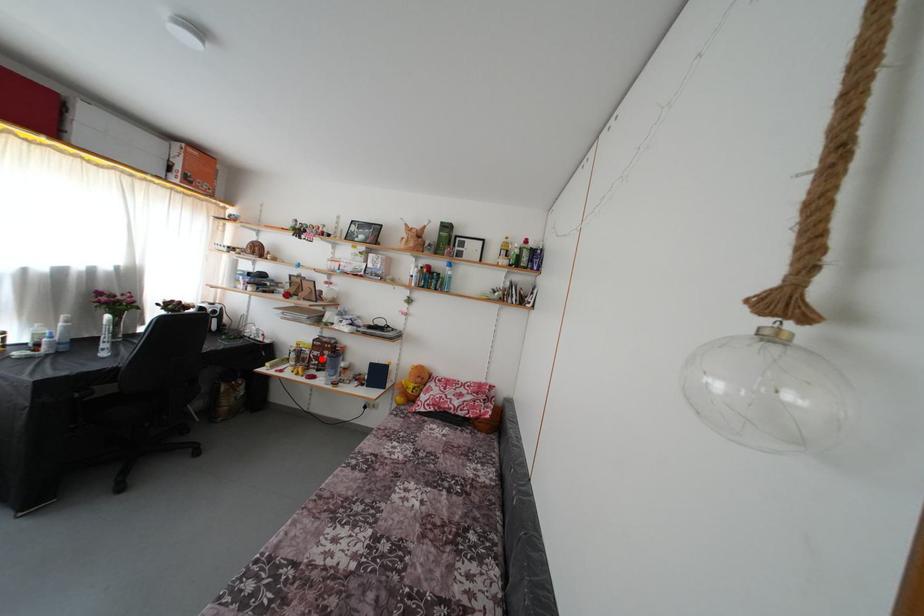
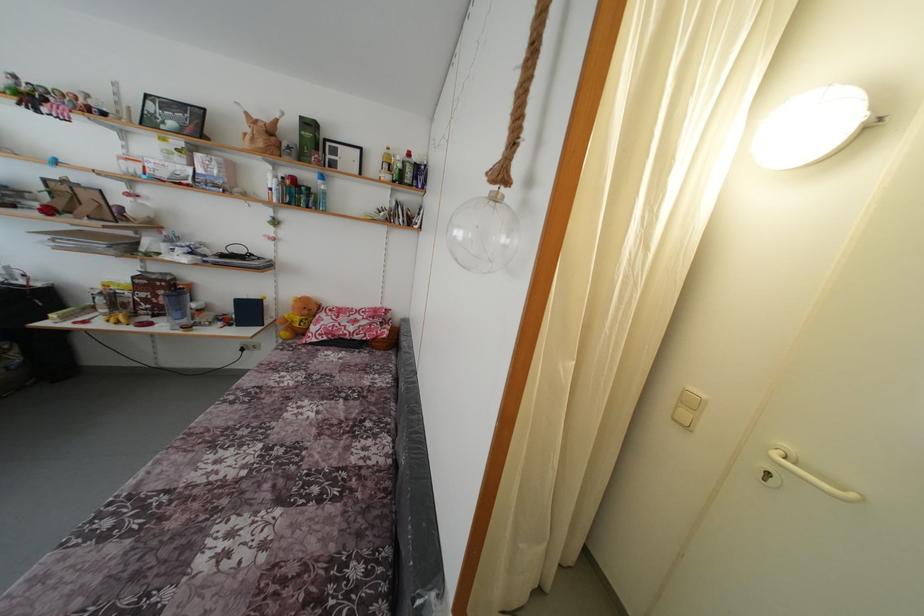
Locate, in the second image, the point that corresponds to the highlighted location in the first image.

(149, 301)